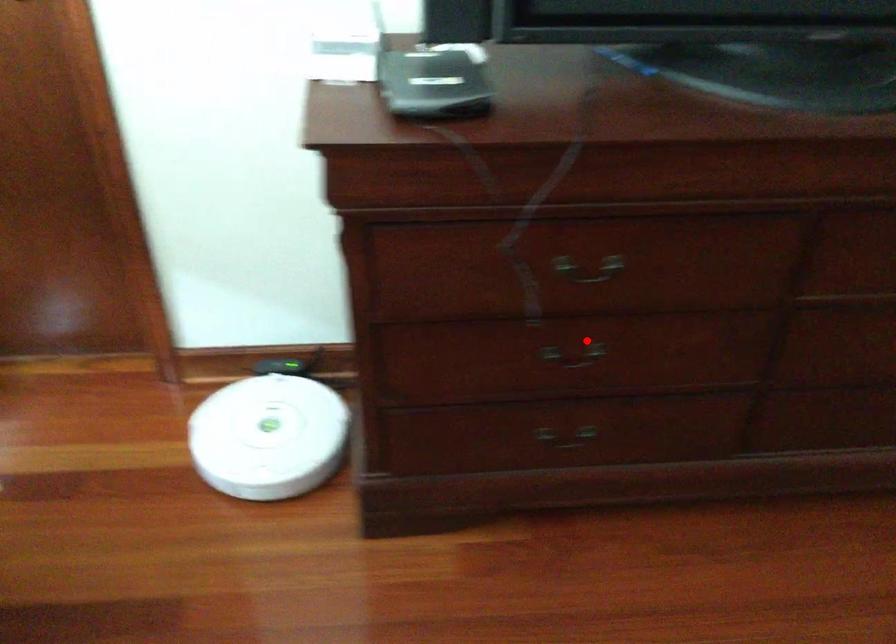
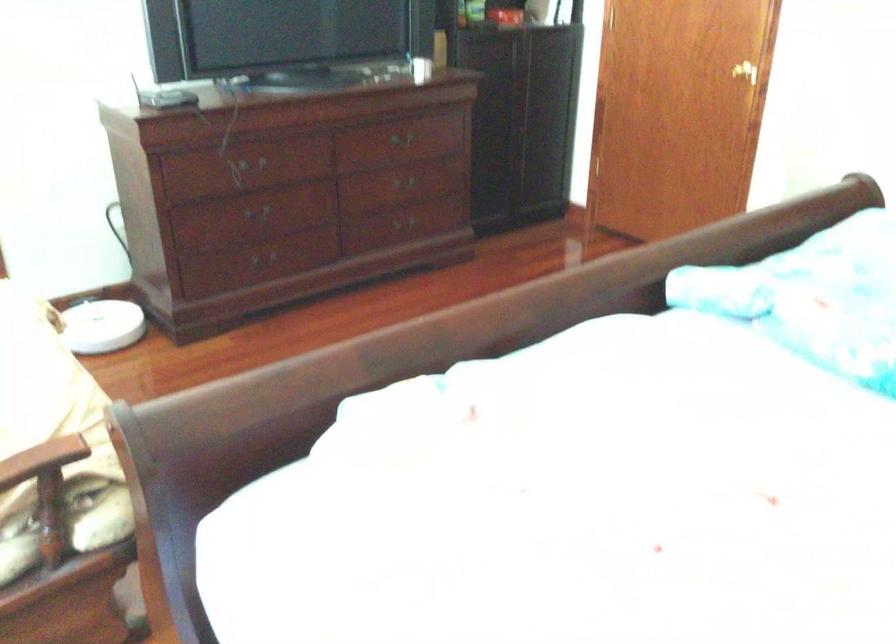
Question: I am providing you with two images of the same scene from different viewpoints. Given a red point in image1, look at the same physical point in image2. Is it:

Choices:
 (A) Closer to the viewpoint
 (B) Farther from the viewpoint

Answer: (B)